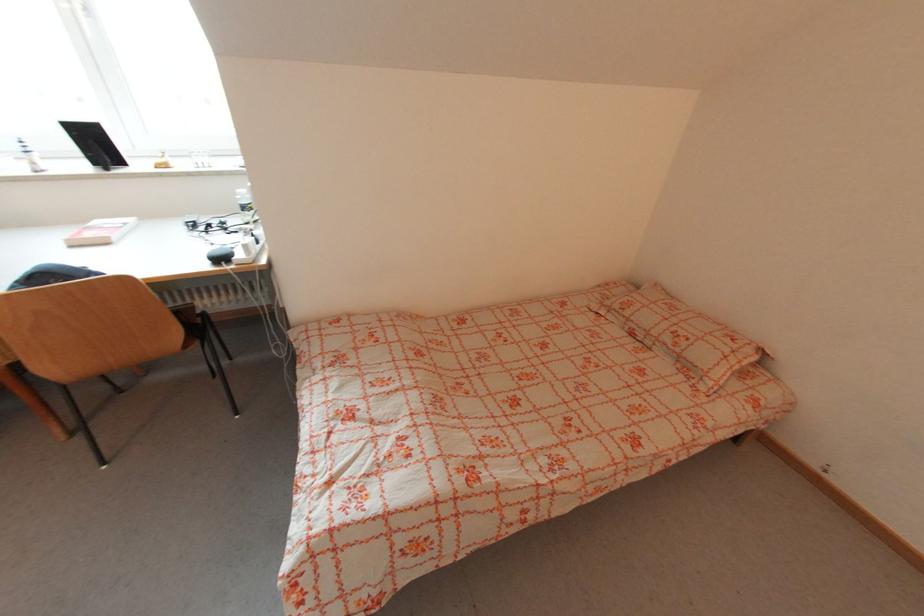
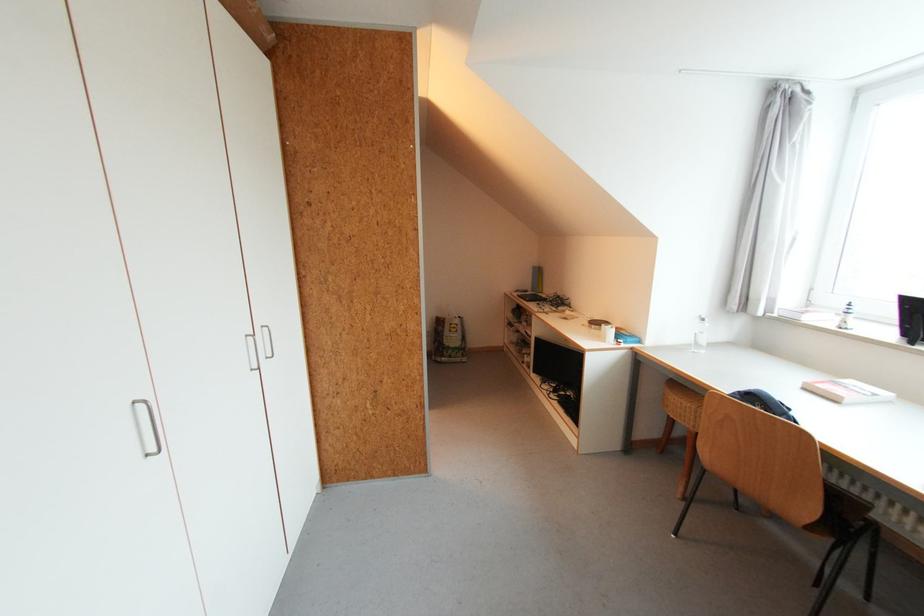
Find the pixel in the second image that matches (x=41, y=172) in the first image.

(845, 329)